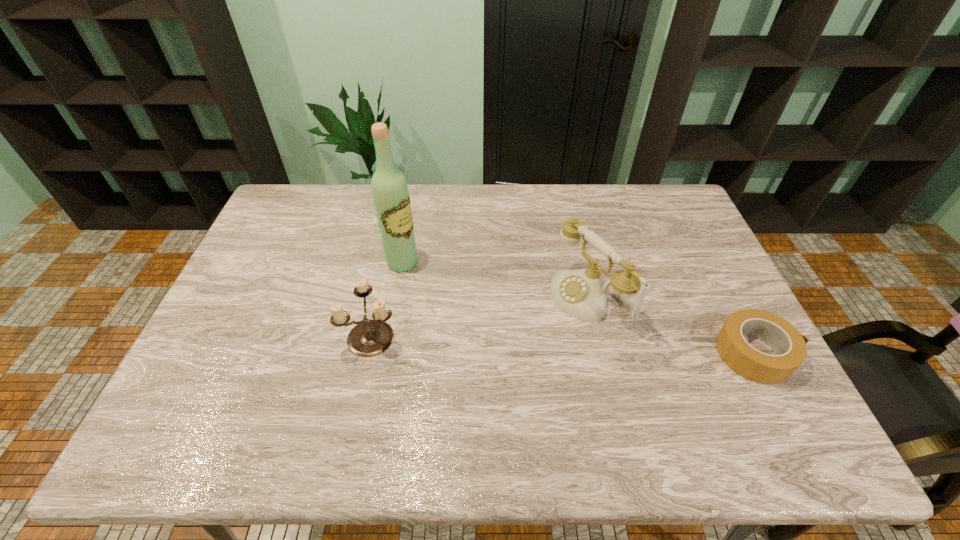
Identify the location of empty space that is in between the telephone and the wine bottle. (496, 280).

Where is `empty space that is in between the tallest object and the second object from right to left`? empty space that is in between the tallest object and the second object from right to left is located at coordinates (496, 280).

I want to click on free space between the tallest object and the third object from left to right, so click(x=496, y=280).

You are a GUI agent. You are given a task and a screenshot of the screen. Output one action in this format:
    pyautogui.click(x=<x>, y=<y>)
    Task: Click on the vacant space in between the third object from left to right and the wine bottle
    The width and height of the screenshot is (960, 540).
    Given the screenshot: What is the action you would take?
    pyautogui.click(x=496, y=280)

Locate an element on the screen. Image resolution: width=960 pixels, height=540 pixels. unoccupied position between the candle holder and the second object from right to left is located at coordinates (481, 316).

At what (x,y) coordinates should I click in order to perform the action: click on free space between the third object from left to right and the tallest object. Please return your answer as a coordinate pair (x, y). This screenshot has width=960, height=540. Looking at the image, I should click on (496, 280).

You are a GUI agent. You are given a task and a screenshot of the screen. Output one action in this format:
    pyautogui.click(x=<x>, y=<y>)
    Task: Click on the free spot between the candle holder and the third object from left to right
    This screenshot has width=960, height=540.
    Given the screenshot: What is the action you would take?
    pyautogui.click(x=481, y=316)

You are a GUI agent. You are given a task and a screenshot of the screen. Output one action in this format:
    pyautogui.click(x=<x>, y=<y>)
    Task: Click on the free space between the duct tape and the telephone
    
    Given the screenshot: What is the action you would take?
    pyautogui.click(x=673, y=325)

You are a GUI agent. You are given a task and a screenshot of the screen. Output one action in this format:
    pyautogui.click(x=<x>, y=<y>)
    Task: Click on the empty location between the telephone and the shortest object
    This screenshot has width=960, height=540.
    Given the screenshot: What is the action you would take?
    pyautogui.click(x=673, y=325)

The width and height of the screenshot is (960, 540). I want to click on object that can be found as the closest to the second object from right to left, so click(x=789, y=345).